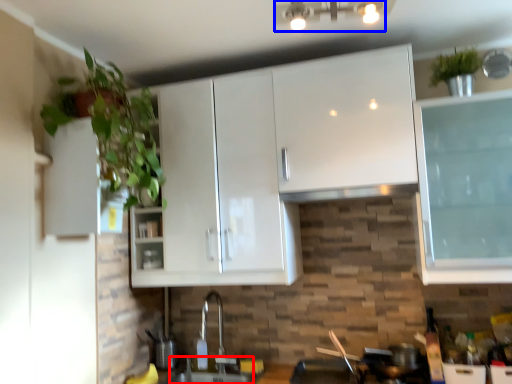
Question: Which of the following is the farthest to the observer, sink (highlighted by a red box) or light fixture (highlighted by a blue box)?

Choices:
 (A) sink
 (B) light fixture

Answer: (A)